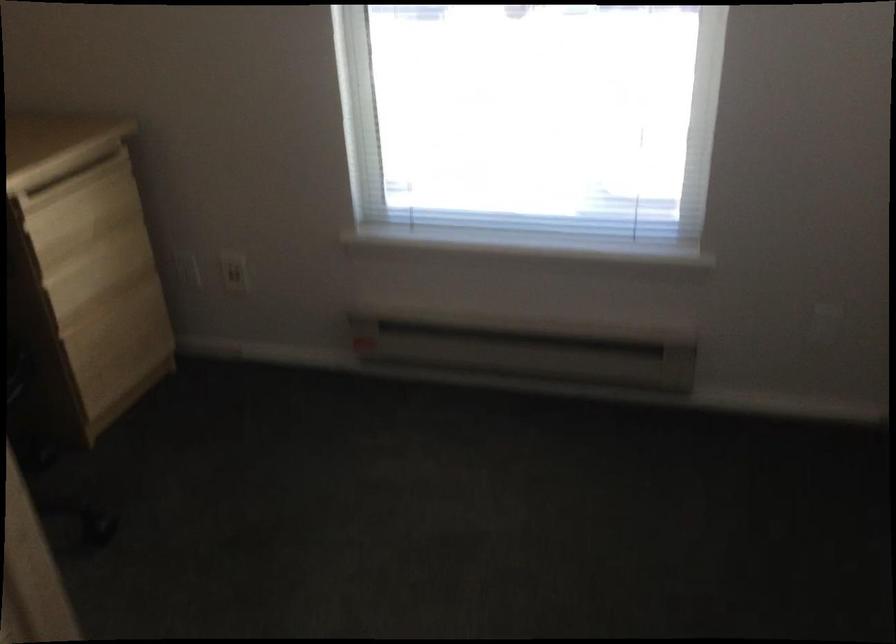
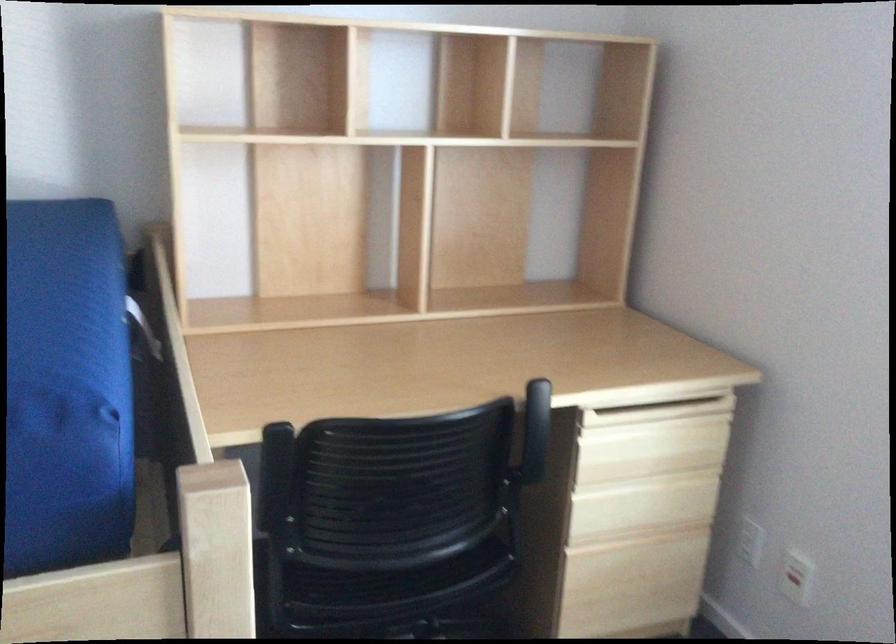
Locate, in the second image, the point that corresponds to (x=101, y=272) in the first image.

(642, 506)